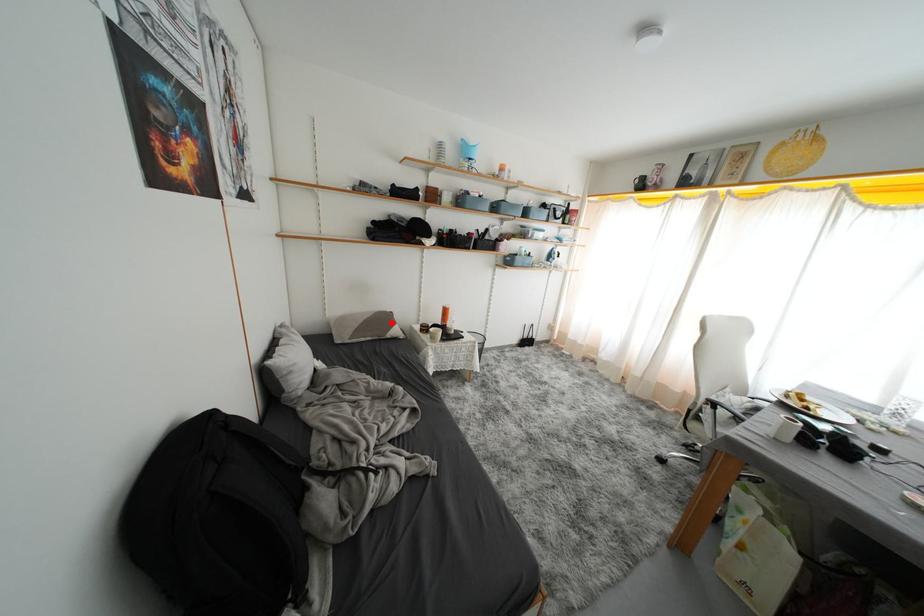
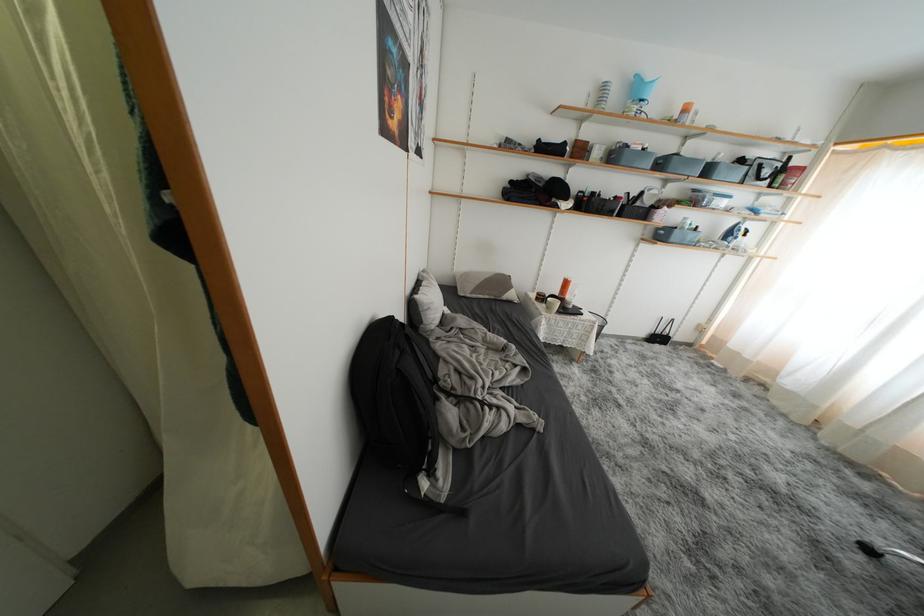
In the second image, find the point that corresponds to the highlighted location in the first image.

(508, 286)